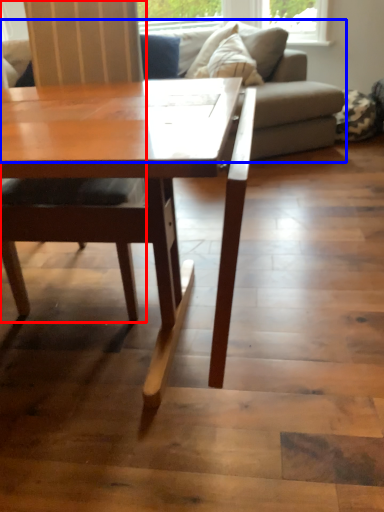
Question: Which object is further to the camera taking this photo, chair (highlighted by a red box) or studio couch (highlighted by a blue box)?

Choices:
 (A) chair
 (B) studio couch

Answer: (B)